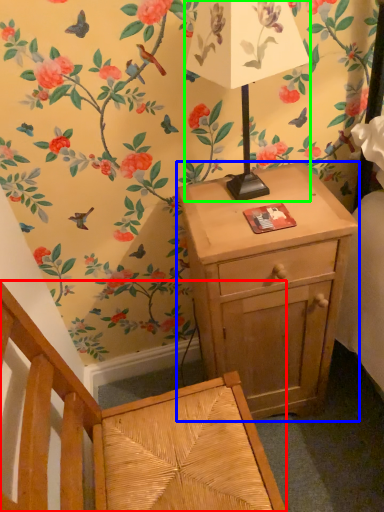
Question: Based on their relative distances, which object is farther from armchair (highlighted by a red box)? Choose from nightstand (highlighted by a blue box) and table lamp (highlighted by a green box).

Choices:
 (A) nightstand
 (B) table lamp

Answer: (B)